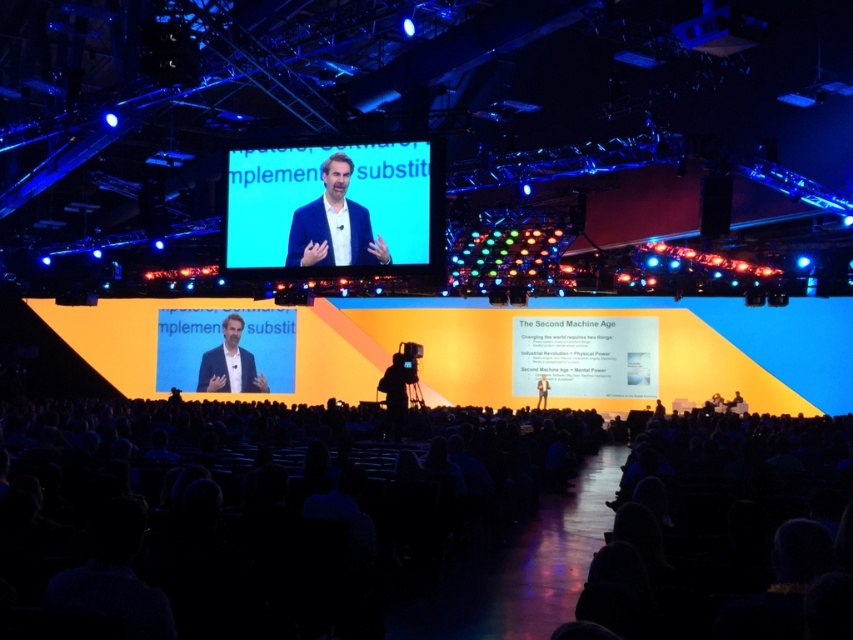
Is dark blue fabric at lower center to the left of blue fabric screen at center from the viewer's perspective?

Incorrect, dark blue fabric at lower center is not on the left side of blue fabric screen at center.

Between dark blue fabric at lower center and blue fabric screen at center, which one appears on the right side from the viewer's perspective?

dark blue fabric at lower center

Which is behind, point (345, 524) or point (428, 179)?

Point (428, 179)

At what (x,y) coordinates should I click in order to perform the action: click on dark blue fabric at lower center. Please return your answer as a coordinate pair (x, y). The width and height of the screenshot is (853, 640). Looking at the image, I should click on (252, 515).

Between dark blue fabric at lower center and blue fabric at upper center, which one has less height?

dark blue fabric at lower center

Does dark blue fabric at lower center appear on the right side of blue fabric at upper center?

Correct, you'll find dark blue fabric at lower center to the right of blue fabric at upper center.

The image size is (853, 640). What do you see at coordinates (252, 515) in the screenshot?
I see `dark blue fabric at lower center` at bounding box center [252, 515].

Identify the location of dark blue fabric at lower center. Image resolution: width=853 pixels, height=640 pixels. (252, 515).

Who is more forward, (424, 196) or (258, 378)?

Positioned in front is point (424, 196).

Between blue fabric screen at center and matte black suit at center, which one is positioned higher?

blue fabric screen at center is higher up.

Identify the location of blue fabric screen at center. (335, 209).